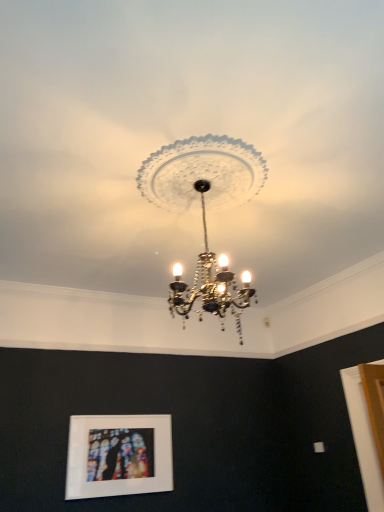
Question: Considering the relative positions of matte white picture frame at lower center and clear glass chandelier at center in the image provided, is matte white picture frame at lower center to the left or to the right of clear glass chandelier at center?

Choices:
 (A) left
 (B) right

Answer: (A)

Question: Considering the positions of matte white picture frame at lower center and clear glass chandelier at center in the image, is matte white picture frame at lower center bigger or smaller than clear glass chandelier at center?

Choices:
 (A) small
 (B) big

Answer: (A)

Question: From a real-world perspective, relative to clear glass chandelier at center, is matte white picture frame at lower center vertically above or below?

Choices:
 (A) above
 (B) below

Answer: (B)

Question: Is clear glass chandelier at center to the left or to the right of matte white picture frame at lower center in the image?

Choices:
 (A) left
 (B) right

Answer: (B)

Question: From a real-world perspective, is clear glass chandelier at center above or below matte white picture frame at lower center?

Choices:
 (A) above
 (B) below

Answer: (A)

Question: Based on their sizes in the image, would you say clear glass chandelier at center is bigger or smaller than matte white picture frame at lower center?

Choices:
 (A) small
 (B) big

Answer: (B)

Question: Considering the positions of clear glass chandelier at center and matte white picture frame at lower center in the image, is clear glass chandelier at center taller or shorter than matte white picture frame at lower center?

Choices:
 (A) tall
 (B) short

Answer: (A)